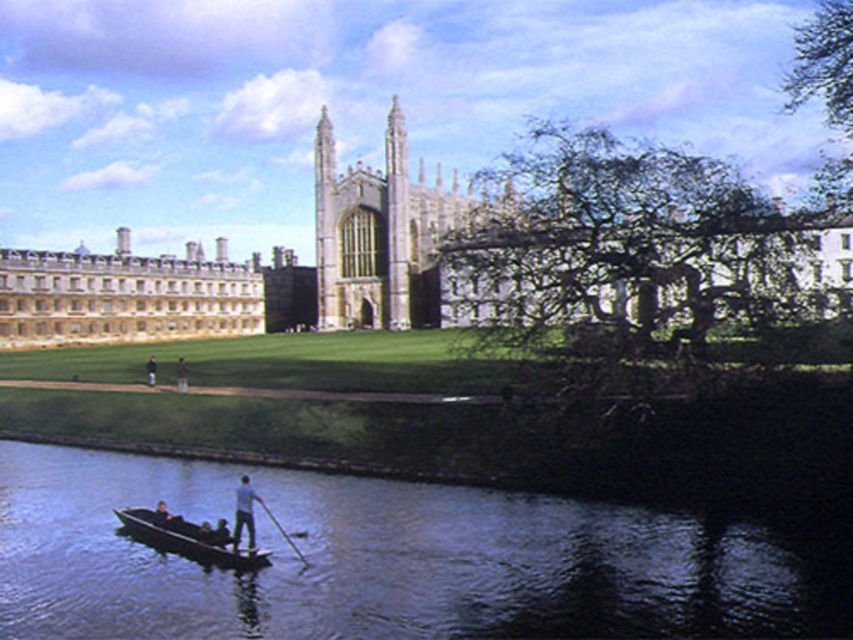
Question: Among these objects, which one is farthest from the camera?

Choices:
 (A) stone gothic cathedral at center
 (B) white cotton shirt at lower center
 (C) dark blue jeans at center

Answer: (C)

Question: Considering the relative positions of stone gothic cathedral at center and dark blue jeans at center in the image provided, where is stone gothic cathedral at center located with respect to dark blue jeans at center?

Choices:
 (A) right
 (B) left

Answer: (A)

Question: Is wooden rowboat at center closer to the viewer compared to light brown wooden paddle at center?

Choices:
 (A) yes
 (B) no

Answer: (A)

Question: Which of the following is the farthest from the observer?

Choices:
 (A) wooden smooth paddle at lower center
 (B) stone gothic cathedral at center
 (C) dark blue jeans at center
 (D) light brown wooden paddle at center

Answer: (C)

Question: Is wooden smooth paddle at lower center positioned in front of light brown wooden paddle at center?

Choices:
 (A) yes
 (B) no

Answer: (A)

Question: Estimate the real-world distances between objects in this image. Which object is farther from the dark blue water at lower center?

Choices:
 (A) dark blue jeans at center
 (B) white cotton shirt at lower center
 (C) stone gothic cathedral at center
 (D) wooden rowboat at center

Answer: (C)